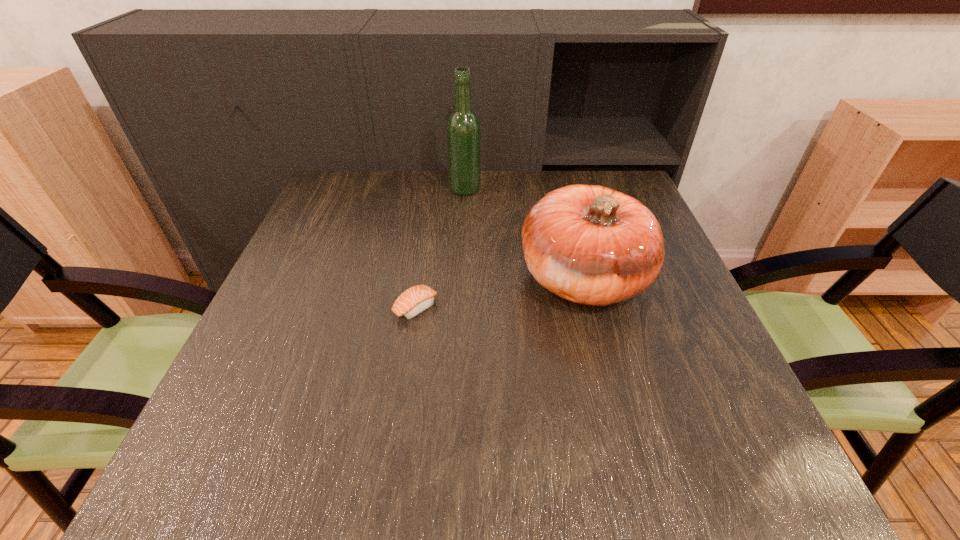
Identify the location of object located at the right edge. The width and height of the screenshot is (960, 540). (589, 244).

Where is `blank area at the far edge`? This screenshot has width=960, height=540. blank area at the far edge is located at coordinates (444, 201).

Identify the location of free space at the near edge. (544, 488).

Where is `blank space at the left edge of the desktop`? The height and width of the screenshot is (540, 960). blank space at the left edge of the desktop is located at coordinates (311, 234).

What are the coordinates of `free space at the right edge of the desktop` in the screenshot? It's located at (719, 419).

You are a GUI agent. You are given a task and a screenshot of the screen. Output one action in this format:
    pyautogui.click(x=<x>, y=<y>)
    Task: Click on the free space at the far left corner
    The image size is (960, 540).
    Given the screenshot: What is the action you would take?
    coord(366,181)

Find the location of `free space between the farthest object and the sushi`. free space between the farthest object and the sushi is located at coordinates (441, 248).

Image resolution: width=960 pixels, height=540 pixels. In order to click on empty location between the sushi and the second object from left to right in this screenshot , I will do `click(441, 248)`.

At what (x,y) coordinates should I click in order to perform the action: click on vacant region between the liquor and the leftmost object. Please return your answer as a coordinate pair (x, y). The height and width of the screenshot is (540, 960). Looking at the image, I should click on (441, 248).

Locate an element on the screen. This screenshot has height=540, width=960. vacant area that lies between the shortest object and the rightmost object is located at coordinates (x=499, y=293).